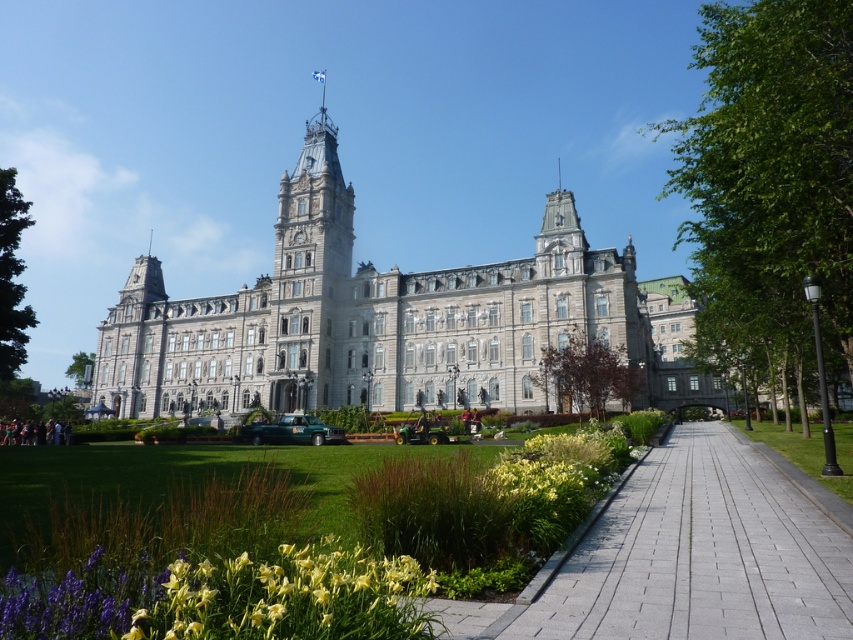
You are a city planner assessing the space in front of the gray stone building at center and the gray concrete sidewalk at center. Which structure occupies more area in the scene?

The gray stone building at center is larger in size than the gray concrete sidewalk at center, so it occupies more area in the scene.